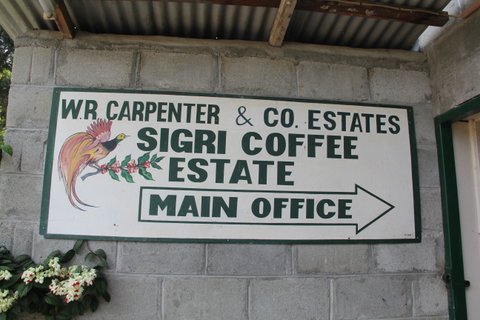
Locate an element on the screen. The height and width of the screenshot is (320, 480). door frame is located at coordinates (452, 190).